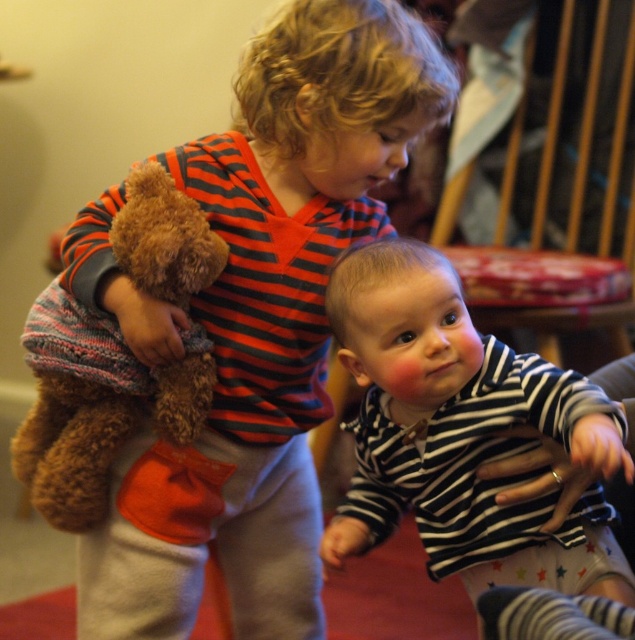
Question: Does striped cotton shirt at center appear on the right side of brown plush teddy bear at left?

Choices:
 (A) no
 (B) yes

Answer: (B)

Question: Among these objects, which one is nearest to the camera?

Choices:
 (A) brown plush teddy bear at left
 (B) soft brown teddy bear at center

Answer: (A)

Question: Does soft brown teddy bear at center have a larger size compared to brown plush teddy bear at left?

Choices:
 (A) yes
 (B) no

Answer: (A)

Question: Which point is farther to the camera?

Choices:
 (A) soft brown teddy bear at center
 (B) striped cotton shirt at center

Answer: (A)

Question: Among these points, which one is nearest to the camera?

Choices:
 (A) tap(281, 291)
 (B) tap(53, 518)
 (C) tap(389, 472)

Answer: (C)

Question: Is soft brown teddy bear at center below brown plush teddy bear at left?

Choices:
 (A) no
 (B) yes

Answer: (A)